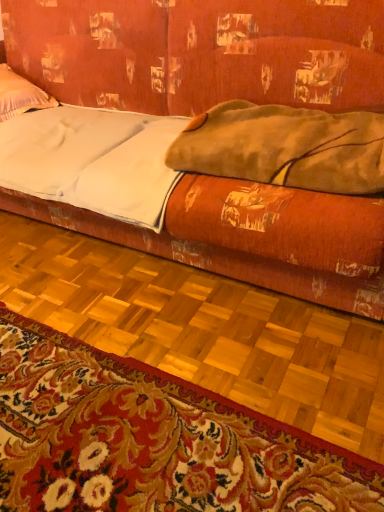
What do you see at coordinates (151, 440) in the screenshot? Image resolution: width=384 pixels, height=512 pixels. I see `carpeted mat at lower center` at bounding box center [151, 440].

The height and width of the screenshot is (512, 384). Identify the location of velvet orange couch at center. (192, 50).

Describe the element at coordinates (20, 95) in the screenshot. I see `white soft pillow at upper left` at that location.

You are a GUI agent. You are given a task and a screenshot of the screen. Output one action in this format:
    pyautogui.click(x=<x>, y=<y>)
    Task: Click on the white soft pillow at upper left
    This screenshot has width=384, height=512.
    Given the screenshot: What is the action you would take?
    pyautogui.click(x=20, y=95)

Where is `fuzzy brown blanket at upper right`? fuzzy brown blanket at upper right is located at coordinates (285, 147).

From a real-world perspective, is velvet orange couch at center above or below white matte sheet at center?

In terms of real-world spatial position, velvet orange couch at center is above white matte sheet at center.

Can you see velvet orange couch at center touching white matte sheet at center?

No, velvet orange couch at center is not next to white matte sheet at center.

Is velvet orange couch at center completely or partially outside of white matte sheet at center?

velvet orange couch at center lies outside white matte sheet at center's area.

Which is behind, point (141, 12) or point (135, 114)?

The point (135, 114) is farther from the camera.

Is point (170, 94) in front of point (146, 488)?

No, it is behind (146, 488).

Is there a large distance between velvet orange couch at center and carpeted mat at lower center?

That's right, there is a large distance between velvet orange couch at center and carpeted mat at lower center.

Is velvet orange couch at center wider or thinner than carpeted mat at lower center?

In the image, velvet orange couch at center appears to be wider than carpeted mat at lower center.

How many degrees apart are the facing directions of white matte sheet at center and fuzzy brown blanket at upper right?

The angular difference between white matte sheet at center and fuzzy brown blanket at upper right is 1.18 degrees.

Is white matte sheet at center completely or partially outside of fuzzy brown blanket at upper right?

white matte sheet at center is positioned outside fuzzy brown blanket at upper right.

Is point (160, 170) closer or farther from the camera than point (202, 127)?

Point (160, 170) is positioned closer to the camera compared to point (202, 127).

From the image's perspective, would you say white matte sheet at center is shown under fuzzy brown blanket at upper right?

No, from the image's perspective, white matte sheet at center is not beneath fuzzy brown blanket at upper right.

Which is farther from the camera, (8, 166) or (59, 351)?

Positioned behind is point (8, 166).

The image size is (384, 512). Identify the location of sheet on the left of carpeted mat at lower center. (93, 160).

From the image's perspective, is white matte sheet at center located beneath carpeted mat at lower center?

No, from the image's perspective, white matte sheet at center is not beneath carpeted mat at lower center.

What's the angular difference between white matte sheet at center and carpeted mat at lower center's facing directions?

180 degrees.

Would you say white soft pillow at upper left is inside or outside carpeted mat at lower center?

white soft pillow at upper left is not inside carpeted mat at lower center, it's outside.

Which object is wider, white soft pillow at upper left or carpeted mat at lower center?

With larger width is carpeted mat at lower center.

Is the depth of white soft pillow at upper left greater than that of carpeted mat at lower center?

Yes, white soft pillow at upper left is further from the camera.

From the image's perspective, is white soft pillow at upper left positioned above or below carpeted mat at lower center?

white soft pillow at upper left is situated higher than carpeted mat at lower center in the image.

Considering the sizes of objects carpeted mat at lower center and velvet orange couch at center in the image provided, who is shorter, carpeted mat at lower center or velvet orange couch at center?

Standing shorter between the two is carpeted mat at lower center.

Relative to velvet orange couch at center, is carpeted mat at lower center in front or behind?

Visually, carpeted mat at lower center is located behind velvet orange couch at center.

How distant is carpeted mat at lower center from velvet orange couch at center?

carpeted mat at lower center is 1.24 meters away from velvet orange couch at center.

From a real-world perspective, between carpeted mat at lower center and velvet orange couch at center, who is vertically lower?

carpeted mat at lower center is physically lower.

From the image's perspective, is white matte sheet at center over white soft pillow at upper left?

No, from the image's perspective, white matte sheet at center is not over white soft pillow at upper left.

Which of these two, white matte sheet at center or white soft pillow at upper left, stands shorter?

white matte sheet at center is shorter.

Which of these two, white matte sheet at center or white soft pillow at upper left, is thinner?

With smaller width is white soft pillow at upper left.

You are a GUI agent. You are given a task and a screenshot of the screen. Output one action in this format:
    pyautogui.click(x=<x>, y=<y>)
    Task: Click on the studio couch that is above the white matte sheet at center (from a real-world perspective)
    Image resolution: width=384 pixels, height=512 pixels.
    Given the screenshot: What is the action you would take?
    pyautogui.click(x=192, y=50)

This screenshot has width=384, height=512. In order to click on studio couch that is in front of the carpeted mat at lower center in this screenshot , I will do `click(192, 50)`.

From the picture: Estimate the real-world distances between objects in this image. Which object is further from white soft pillow at upper left, white matte sheet at center or fuzzy brown blanket at upper right?

fuzzy brown blanket at upper right lies further to white soft pillow at upper left than the other object.

Estimate the real-world distances between objects in this image. Which object is closer to white matte sheet at center, fuzzy brown blanket at upper right or white soft pillow at upper left?

The object closer to white matte sheet at center is fuzzy brown blanket at upper right.

From the image, which object appears to be farther from white matte sheet at center, velvet orange couch at center or carpeted mat at lower center?

The object further to white matte sheet at center is carpeted mat at lower center.

Which object lies further to the anchor point white matte sheet at center, carpeted mat at lower center or white soft pillow at upper left?

carpeted mat at lower center is positioned further to the anchor white matte sheet at center.

Looking at the image, which one is located closer to carpeted mat at lower center, white soft pillow at upper left or fuzzy brown blanket at upper right?

fuzzy brown blanket at upper right.

Looking at the image, which one is located further to white soft pillow at upper left, white matte sheet at center or carpeted mat at lower center?

carpeted mat at lower center is further to white soft pillow at upper left.

Estimate the real-world distances between objects in this image. Which object is closer to white matte sheet at center, white soft pillow at upper left or fuzzy brown blanket at upper right?

Among the two, fuzzy brown blanket at upper right is located nearer to white matte sheet at center.

When comparing their distances from velvet orange couch at center, does white soft pillow at upper left or white matte sheet at center seem further?

white soft pillow at upper left.

The image size is (384, 512). I want to click on blanket between white matte sheet at center and carpeted mat at lower center in the vertical direction, so click(285, 147).

You are a GUI agent. You are given a task and a screenshot of the screen. Output one action in this format:
    pyautogui.click(x=<x>, y=<y>)
    Task: Click on the blanket between white soft pillow at upper left and carpeted mat at lower center from top to bottom
    Image resolution: width=384 pixels, height=512 pixels.
    Given the screenshot: What is the action you would take?
    pyautogui.click(x=285, y=147)

You are a GUI agent. You are given a task and a screenshot of the screen. Output one action in this format:
    pyautogui.click(x=<x>, y=<y>)
    Task: Click on the studio couch between white soft pillow at upper left and carpeted mat at lower center in the vertical direction
    The height and width of the screenshot is (512, 384).
    Given the screenshot: What is the action you would take?
    pyautogui.click(x=192, y=50)

Locate an element on the screen. This screenshot has width=384, height=512. sheet between white soft pillow at upper left and carpeted mat at lower center in the up-down direction is located at coordinates (93, 160).